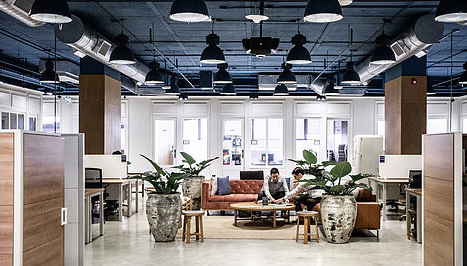
Image resolution: width=467 pixels, height=266 pixels. Find the location of `3 desks on the left`. 3 desks on the left is located at coordinates (93, 194), (119, 185), (135, 179).